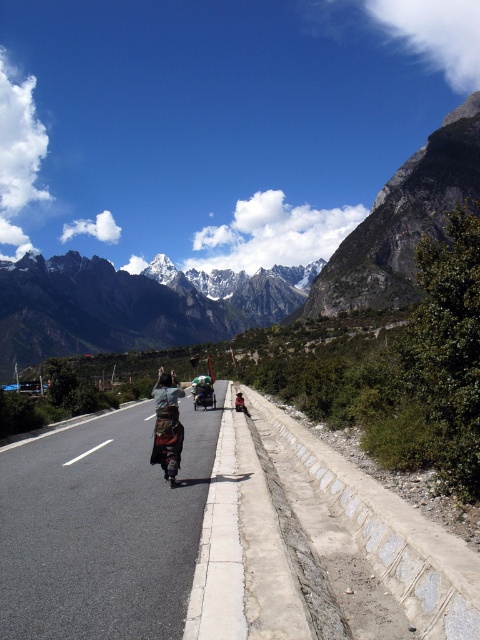
You are driving a car and want to continue straight on the road. Which path should you follow, the black asphalt road at center or the smooth concrete path at center?

You should follow the black asphalt road at center because it is in front of the smooth concrete path at center, indicating it is the correct path to continue straight.

You are a hiker planning to take a photo of the white rocky mountain range at upper center from the black asphalt road at center. Considering their sizes, which object will appear larger in your camera view?

The white rocky mountain range at upper center will appear larger in the camera view because it is larger than the black asphalt road at center according to the description.